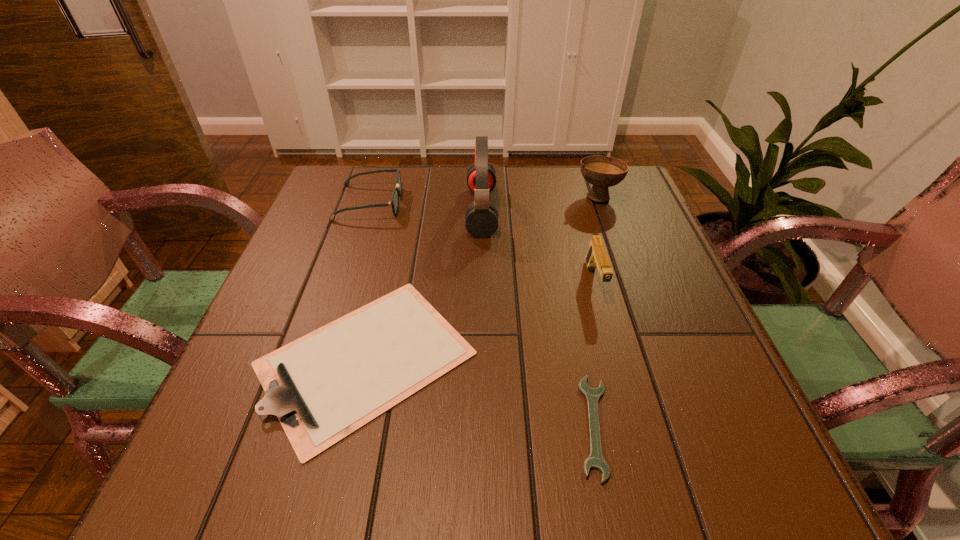
At what (x,y) coordinates should I click in order to perform the action: click on free spot at the right edge of the desktop. Please return your answer as a coordinate pair (x, y). Image resolution: width=960 pixels, height=540 pixels. Looking at the image, I should click on (625, 247).

Identify the location of empty space that is in between the wrench and the fourth tallest object. This screenshot has width=960, height=540. (482, 314).

This screenshot has width=960, height=540. In order to click on empty space that is in between the fourth object from left to right and the second shortest object in this screenshot , I will do `click(480, 393)`.

This screenshot has width=960, height=540. I want to click on vacant area that lies between the fourth object from left to right and the tallest object, so click(538, 319).

Identify the location of free space between the shortest object and the earphone. The image size is (960, 540). (538, 319).

This screenshot has width=960, height=540. I want to click on unoccupied position between the fourth object from left to right and the tallest object, so click(x=538, y=319).

The width and height of the screenshot is (960, 540). I want to click on free space between the wrench and the fourth tallest object, so click(x=482, y=314).

Image resolution: width=960 pixels, height=540 pixels. Identify the location of vacant area between the second shortest object and the spectacles. (368, 281).

This screenshot has width=960, height=540. Find the location of `free space between the third shortest object and the second shortest object`. free space between the third shortest object and the second shortest object is located at coordinates (368, 281).

Find the location of `vacant area that lies between the fifth tallest object and the spectacles`. vacant area that lies between the fifth tallest object and the spectacles is located at coordinates (368, 281).